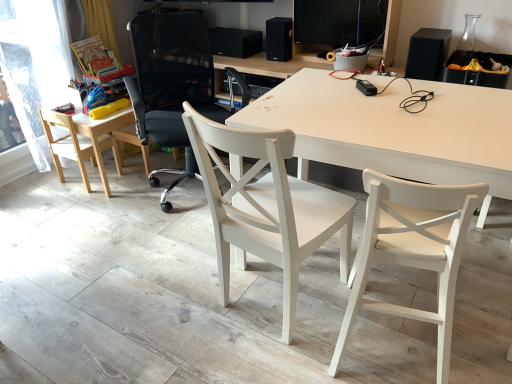
Identify the location of vacant area that lies between white matte chair at center, the 1th chair positioned from the right, and white wood chair at center, placed as the 2th chair when sorted from right to left. (325, 322).